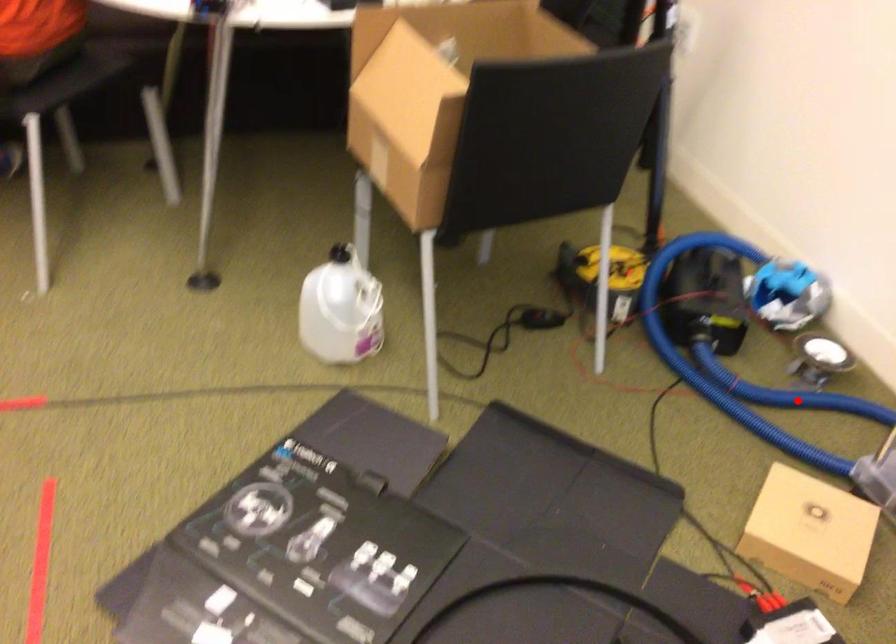
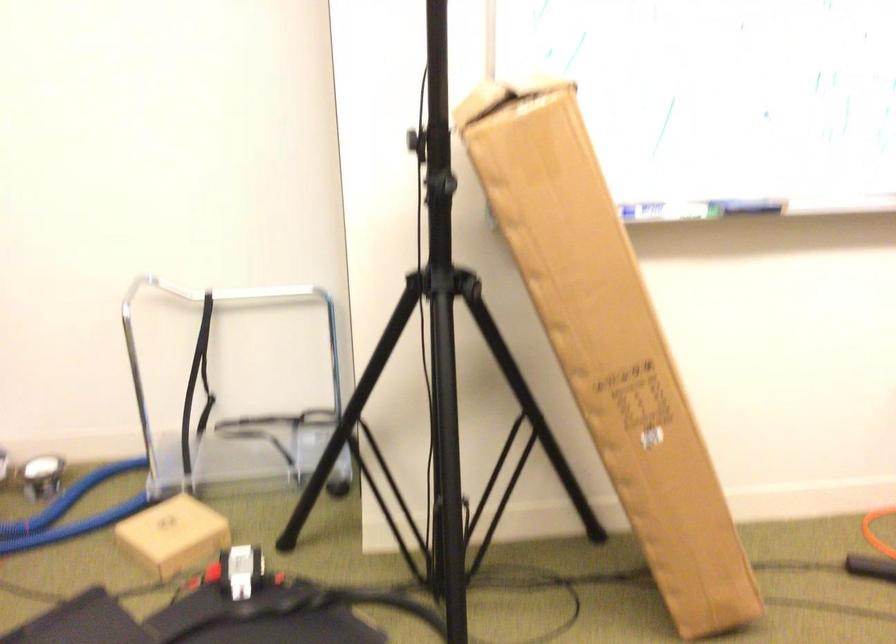
Locate, in the second image, the point that corresponds to the highlighted location in the first image.

(67, 498)